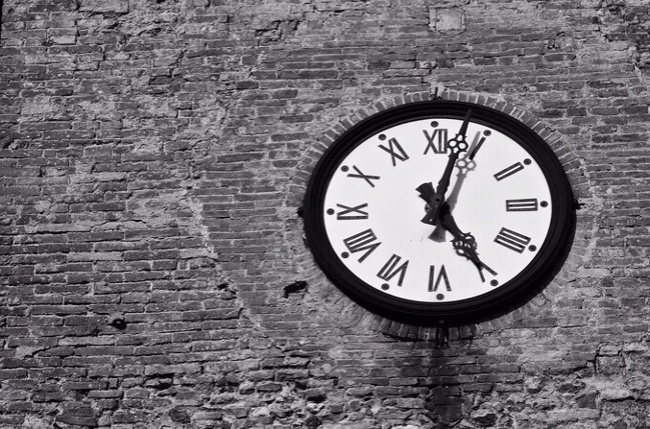
You are a GUI agent. You are given a task and a screenshot of the screen. Output one action in this format:
    pyautogui.click(x=<x>, y=<y>)
    Task: Click on the clock hands
    Image resolution: width=650 pixels, height=429 pixels.
    Given the screenshot: What is the action you would take?
    pyautogui.click(x=437, y=197)